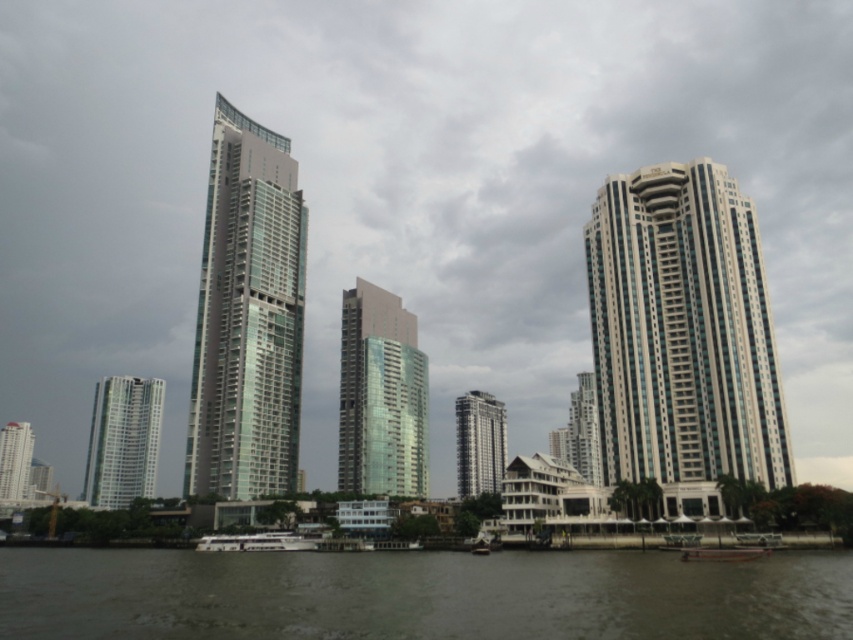
Question: Which of the following is the farthest from the observer?

Choices:
 (A) transparent glass building at center
 (B) white glossy boat at lower center
 (C) metallic silver boat at lower center
 (D) matte white building at lower left

Answer: (D)

Question: Which point is farther to the camera?

Choices:
 (A) (115, 420)
 (B) (776, 484)
 (C) (258, 225)

Answer: (A)

Question: Is transparent glass building at center further to the viewer compared to glassy teal skyscraper at left?

Choices:
 (A) yes
 (B) no

Answer: (B)

Question: Which point is closer to the camera?

Choices:
 (A) (225, 595)
 (B) (257, 545)

Answer: (A)

Question: Does brown murky water at lower center have a smaller size compared to glassy teal skyscraper at left?

Choices:
 (A) yes
 (B) no

Answer: (A)

Question: Is white glass building at center below transparent glass building at center?

Choices:
 (A) no
 (B) yes

Answer: (A)